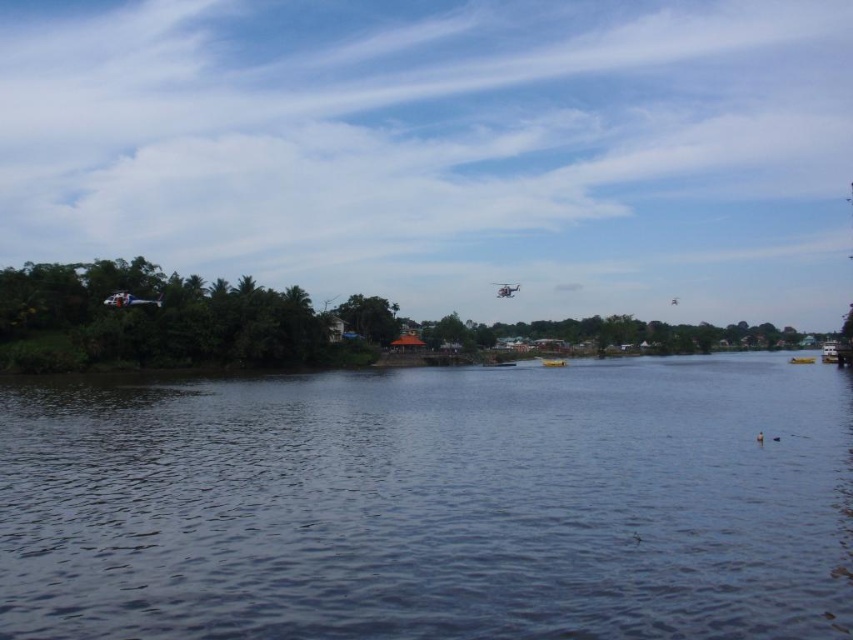
You are standing on the riverside and want to take a photo of the dark blue water at center and the yellow matte boat at lower right. Which object will appear larger in your photo?

The dark blue water at center will appear larger in your photo because it is closer to the viewer than the yellow matte boat at lower right.

You are standing on the riverside and see the dark blue water at center and the yellow matte boat at center. Which object is located more to the left side?

The dark blue water at center is positioned on the left side of yellow matte boat at center, so it is more to the left side.

You are a photographer who wants to capture both yellow matte boat at center and yellow matte boat at lower right in a single shot. Which boat should you position closer to the center of your camera frame to ensure both are visible without zooming in?

You should position the yellow matte boat at lower right closer to the center of your camera frame because it is wider than the yellow matte boat at center, allowing both to fit within the frame without zooming in.